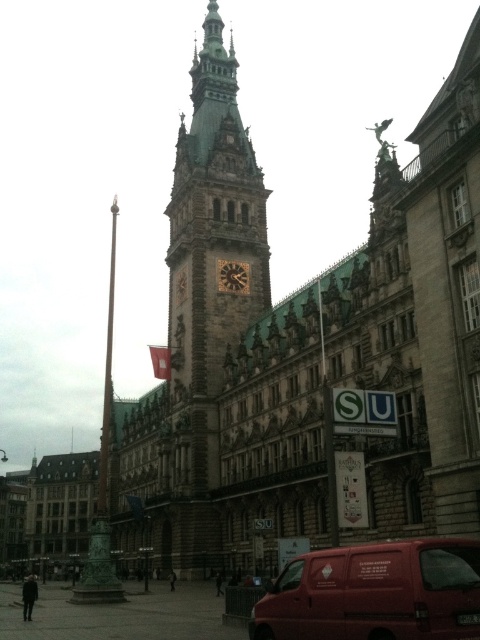
In the scene shown: Between brown stone clock tower at center and gold textured clock at center, which one is positioned higher?

brown stone clock tower at center

This screenshot has height=640, width=480. Identify the location of brown stone clock tower at center. (206, 296).

Identify the location of brown stone clock tower at center. The height and width of the screenshot is (640, 480). (206, 296).

Where is `brown stone clock tower at center`? This screenshot has width=480, height=640. brown stone clock tower at center is located at coordinates (206, 296).

Which is above, gold textured clock at center or silky red flag at center?

gold textured clock at center is higher up.

Measure the distance between point (224, 276) and camera.

Point (224, 276) and camera are 294.28 feet apart.

This screenshot has width=480, height=640. Find the location of `gold textured clock at center`. gold textured clock at center is located at coordinates (232, 276).

This screenshot has width=480, height=640. I want to click on gold textured clock at center, so click(232, 276).

Does brown stone clock tower at center have a smaller size compared to silky red flag at center?

No.

Is point (169, 442) farther from camera compared to point (160, 348)?

No, (169, 442) is closer to viewer.

This screenshot has height=640, width=480. What do you see at coordinates (206, 296) in the screenshot?
I see `brown stone clock tower at center` at bounding box center [206, 296].

Identify the location of brown stone clock tower at center. (206, 296).